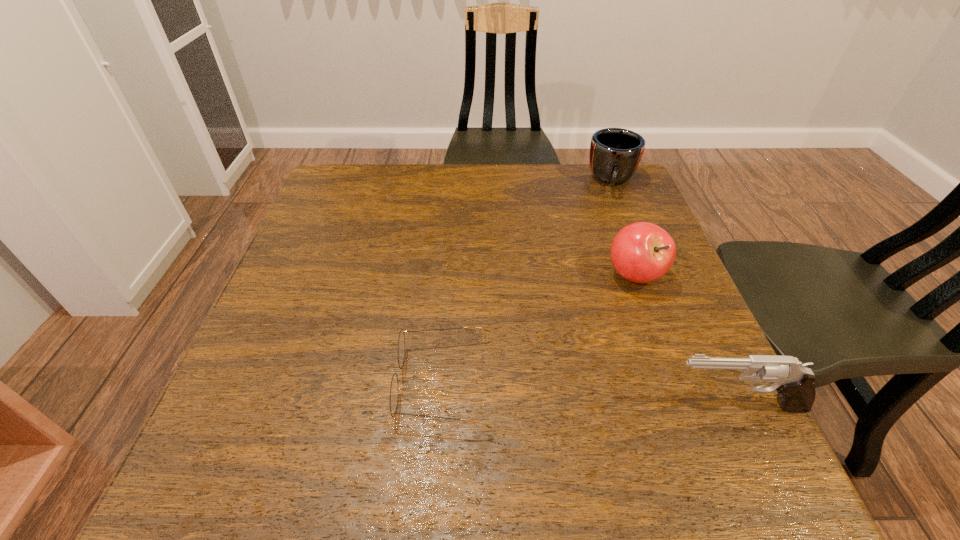
Where is `vacant space located 0.060m at the muzzle of the gun`? This screenshot has height=540, width=960. vacant space located 0.060m at the muzzle of the gun is located at coordinates (632, 405).

You are a GUI agent. You are given a task and a screenshot of the screen. Output one action in this format:
    pyautogui.click(x=<x>, y=<y>)
    Task: Click on the free space located 0.280m on the stem of the apple
    Image resolution: width=960 pixels, height=540 pixels.
    Given the screenshot: What is the action you would take?
    [606, 403]

Image resolution: width=960 pixels, height=540 pixels. I want to click on vacant region located 0.080m on the stem of the apple, so click(624, 321).

You are a GUI agent. You are given a task and a screenshot of the screen. Output one action in this format:
    pyautogui.click(x=<x>, y=<y>)
    Task: Click on the blank space located 0.050m on the stem of the apple
    Image resolution: width=960 pixels, height=540 pixels.
    Given the screenshot: What is the action you would take?
    pyautogui.click(x=627, y=310)

This screenshot has height=540, width=960. In order to click on free point located on the side of the farthest object with the handle in this screenshot , I will do `click(612, 214)`.

I want to click on free space located on the side of the farthest object with the handle, so click(612, 242).

Identify the location of vacant region located on the side of the farthest object with the handle. (611, 264).

Image resolution: width=960 pixels, height=540 pixels. In order to click on object present at the far edge in this screenshot , I will do `click(615, 153)`.

The image size is (960, 540). Find the location of `spectacles that is at the near edge`. spectacles that is at the near edge is located at coordinates (394, 389).

Locate an element on the screen. This screenshot has height=540, width=960. gun that is at the near edge is located at coordinates click(793, 381).